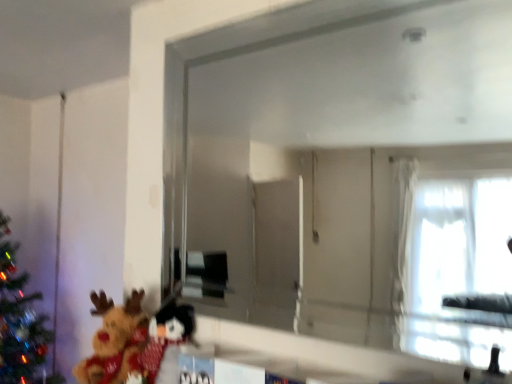
Question: Is point (404, 299) closer or farther from the camera than point (110, 375)?

Choices:
 (A) farther
 (B) closer

Answer: (B)

Question: Is clear glass mirror at center inside the boundaries of fluffy plush at lower left, or outside?

Choices:
 (A) inside
 (B) outside

Answer: (B)

Question: Considering the positions of clear glass mirror at center and fluffy plush at lower left in the image, is clear glass mirror at center bigger or smaller than fluffy plush at lower left?

Choices:
 (A) big
 (B) small

Answer: (A)

Question: Considering the relative positions of fluffy plush at lower left and clear glass mirror at center in the image provided, is fluffy plush at lower left to the left or to the right of clear glass mirror at center?

Choices:
 (A) left
 (B) right

Answer: (A)

Question: Is fluffy plush at lower left situated inside clear glass mirror at center or outside?

Choices:
 (A) inside
 (B) outside

Answer: (B)

Question: Is fluffy plush at lower left wider or thinner than clear glass mirror at center?

Choices:
 (A) wide
 (B) thin

Answer: (A)

Question: Does point click(103, 306) appear closer or farther from the camera than point click(433, 122)?

Choices:
 (A) farther
 (B) closer

Answer: (A)